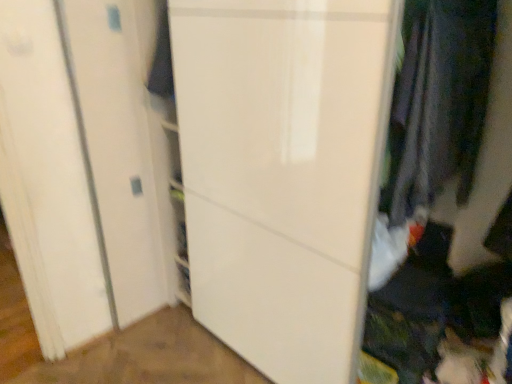
Question: Considering the positions of dark gray fabric at right and white glossy door at center in the image, is dark gray fabric at right wider or thinner than white glossy door at center?

Choices:
 (A) wide
 (B) thin

Answer: (B)

Question: Relative to white glossy door at center, is dark gray fabric at right in front or behind?

Choices:
 (A) front
 (B) behind

Answer: (B)

Question: Considering the positions of dark gray fabric at right and white glossy door at center in the image, is dark gray fabric at right bigger or smaller than white glossy door at center?

Choices:
 (A) big
 (B) small

Answer: (B)

Question: In terms of height, does white glossy door at center look taller or shorter compared to dark gray fabric at right?

Choices:
 (A) short
 (B) tall

Answer: (B)

Question: From the image's perspective, relative to dark gray fabric at right, is white glossy door at center above or below?

Choices:
 (A) above
 (B) below

Answer: (B)

Question: Considering their positions, is white glossy door at center located in front of or behind dark gray fabric at right?

Choices:
 (A) behind
 (B) front

Answer: (B)

Question: In terms of size, does white glossy door at center appear bigger or smaller than dark gray fabric at right?

Choices:
 (A) small
 (B) big

Answer: (B)